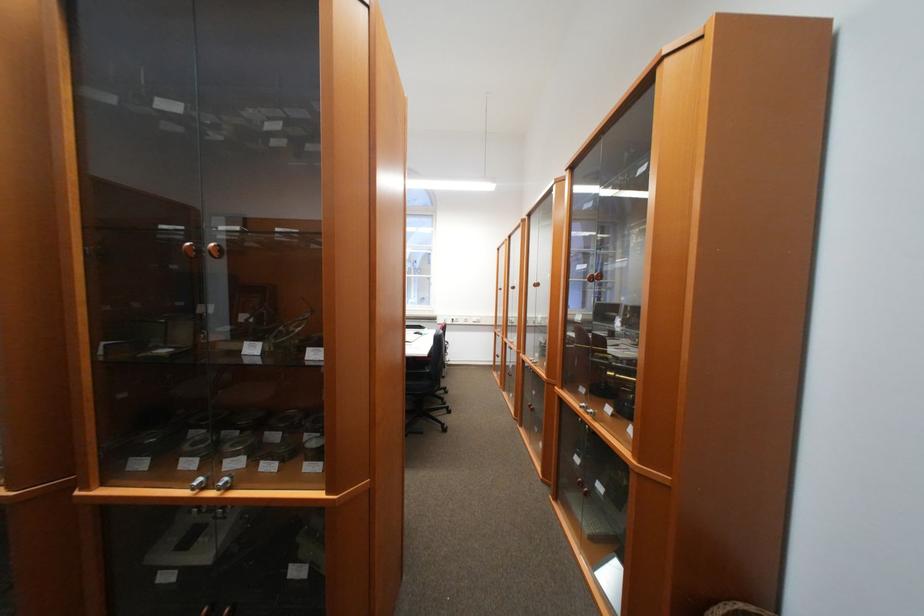
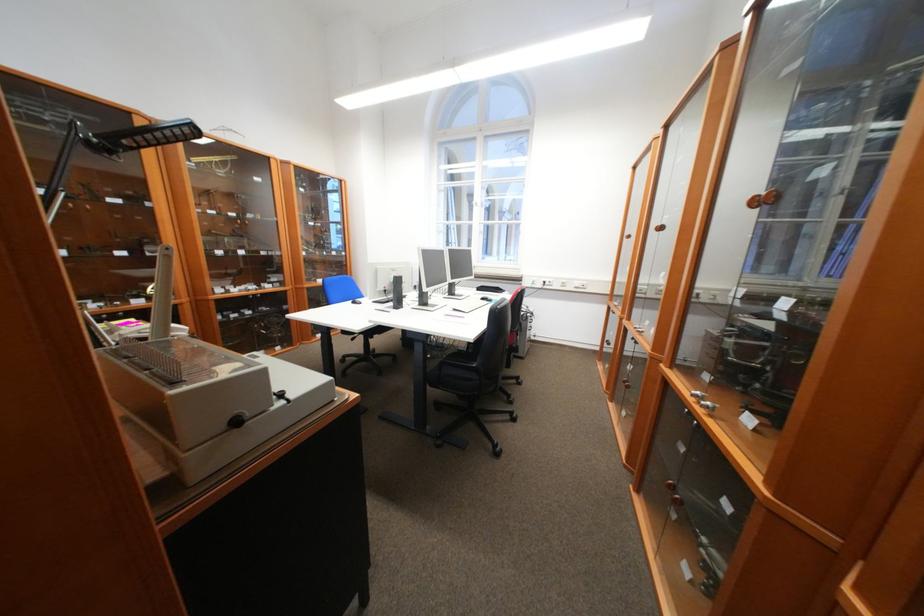
Where in the second image is the point corresponding to pixel 520 286 from the first image?

(663, 225)